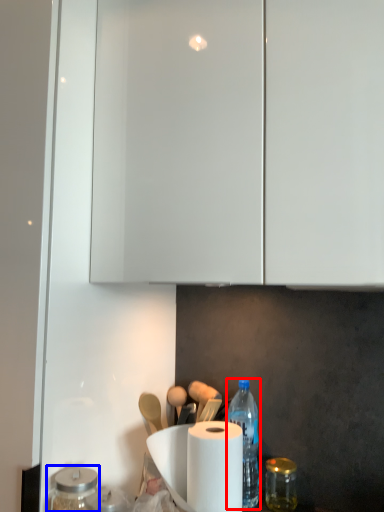
Question: Among these objects, which one is nearest to the camera, bottle (highlighted by a red box) or glass jar (highlighted by a blue box)?

Choices:
 (A) bottle
 (B) glass jar

Answer: (B)